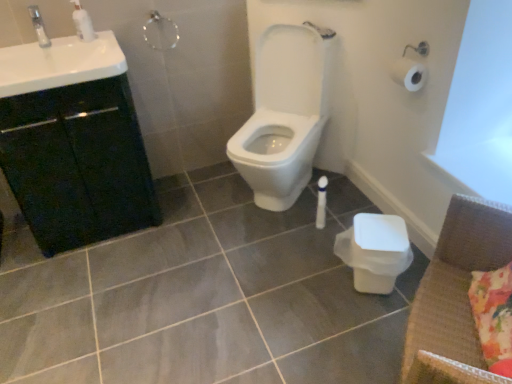
Question: Is white glossy toilet at center completely or partially outside of fluffy floral pillow at lower right?

Choices:
 (A) yes
 (B) no

Answer: (A)

Question: Is white glossy toilet at center shorter than fluffy floral pillow at lower right?

Choices:
 (A) no
 (B) yes

Answer: (A)

Question: Does white glossy toilet at center appear on the left side of fluffy floral pillow at lower right?

Choices:
 (A) no
 (B) yes

Answer: (B)

Question: Are white glossy toilet at center and fluffy floral pillow at lower right located far from each other?

Choices:
 (A) yes
 (B) no

Answer: (A)

Question: Does white glossy toilet at center turn towards fluffy floral pillow at lower right?

Choices:
 (A) no
 (B) yes

Answer: (A)

Question: Is the depth of white glossy toilet at center greater than that of fluffy floral pillow at lower right?

Choices:
 (A) no
 (B) yes

Answer: (B)

Question: From a real-world perspective, is gray glossy tile at center on top of fluffy floral pillow at lower right?

Choices:
 (A) no
 (B) yes

Answer: (A)

Question: From a real-world perspective, is gray glossy tile at center located beneath fluffy floral pillow at lower right?

Choices:
 (A) yes
 (B) no

Answer: (A)

Question: Does gray glossy tile at center have a greater height compared to fluffy floral pillow at lower right?

Choices:
 (A) yes
 (B) no

Answer: (B)

Question: From the image's perspective, is gray glossy tile at center above fluffy floral pillow at lower right?

Choices:
 (A) no
 (B) yes

Answer: (A)

Question: Does gray glossy tile at center have a smaller size compared to fluffy floral pillow at lower right?

Choices:
 (A) yes
 (B) no

Answer: (B)

Question: Does gray glossy tile at center have a greater width compared to fluffy floral pillow at lower right?

Choices:
 (A) yes
 (B) no

Answer: (A)

Question: From a real-world perspective, is white glossy soap dispenser at upper left over white glossy sink at upper left?

Choices:
 (A) yes
 (B) no

Answer: (A)